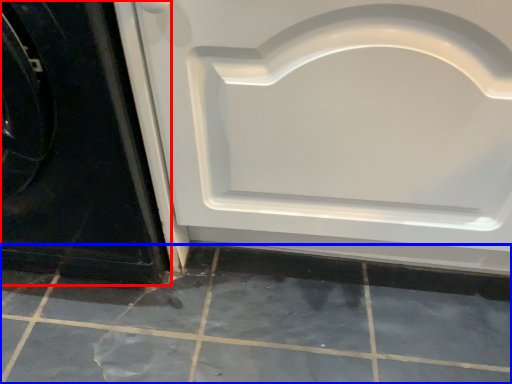
Question: Which of the following is the farthest to the observer, door (highlighted by a red box) or ceramic tile (highlighted by a blue box)?

Choices:
 (A) door
 (B) ceramic tile

Answer: (B)